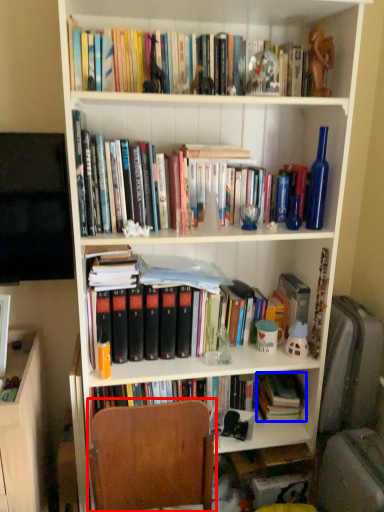
Question: Which object is further to the camera taking this photo, chair (highlighted by a red box) or book (highlighted by a blue box)?

Choices:
 (A) chair
 (B) book

Answer: (B)